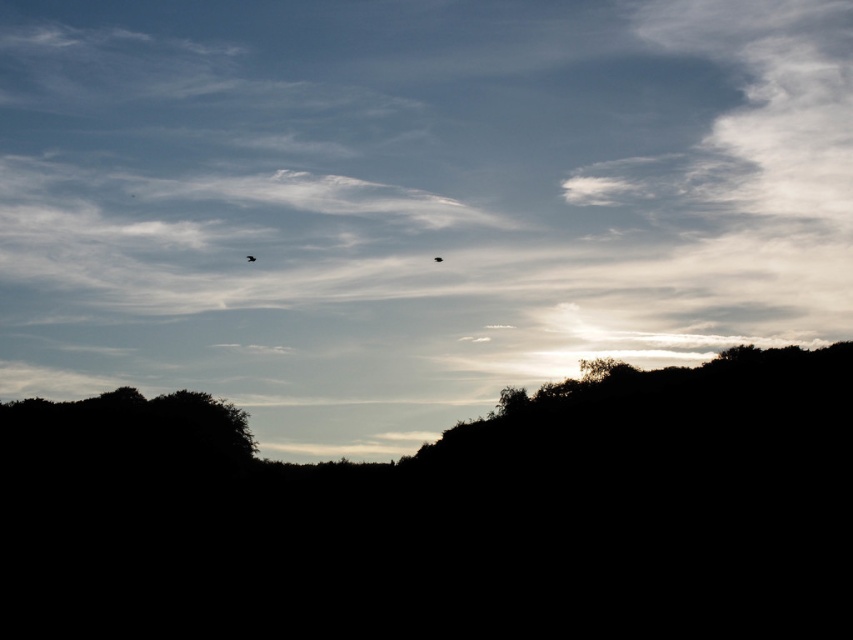
Question: Is white fluffy cloud at upper center behind black silhouetted hillside at center?

Choices:
 (A) yes
 (B) no

Answer: (A)

Question: Is black silhouetted hillside at center closer to camera compared to matte black bird at upper center?

Choices:
 (A) yes
 (B) no

Answer: (A)

Question: Which of the following is the closest to the observer?

Choices:
 (A) (521, 493)
 (B) (30, 236)
 (C) (440, 259)
 (D) (248, 259)

Answer: (A)

Question: In this image, where is black silhouetted hillside at center located relative to black feathered bird at upper center?

Choices:
 (A) left
 (B) right

Answer: (A)

Question: Which object is closer to the camera taking this photo?

Choices:
 (A) white fluffy cloud at upper center
 (B) black silhouetted hillside at center

Answer: (B)

Question: Based on their relative distances, which object is farther from the black feathered bird at upper center?

Choices:
 (A) white fluffy cloud at upper center
 (B) black silhouetted hillside at center
 (C) matte black bird at upper center

Answer: (B)